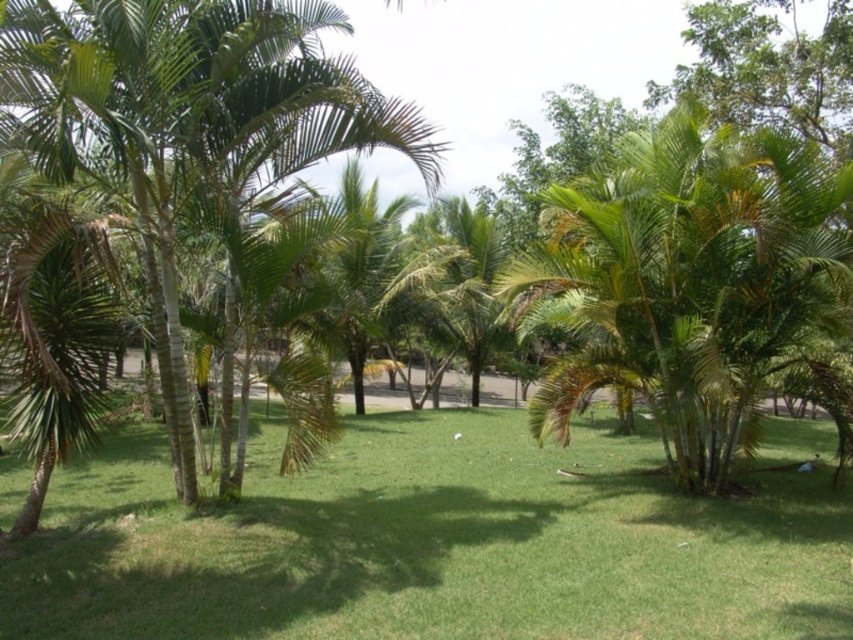
You are a gardener who needs to mow the green grass at center. Your lawnmower has a turning radius of 1.5 meters. Can you turn the lawnmower around the green leafy palm tree at center without hitting it?

The distance between the green grass at center and the green leafy palm tree at center is 2.12 meters. Since the lawnmower requires a turning radius of 1.5 meters, there is sufficient space to maneuver around the tree without collision.

You are standing in the tropical park and want to determine the relative positions of two points marked in the scene. Which point, point (850, 582) or point (331, 147), is closer to you?

Point (850, 582) is closer to the viewer than point (331, 147).